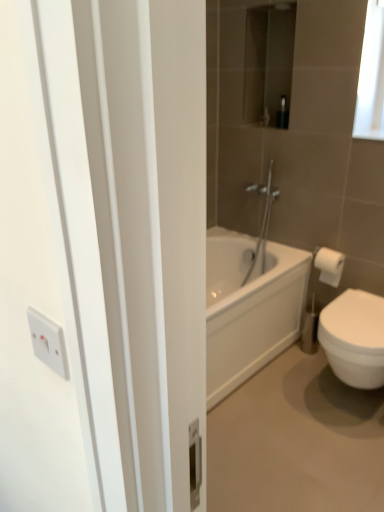
The image size is (384, 512). I want to click on free space above white glossy toilet at lower right (from a real-world perspective), so click(293, 434).